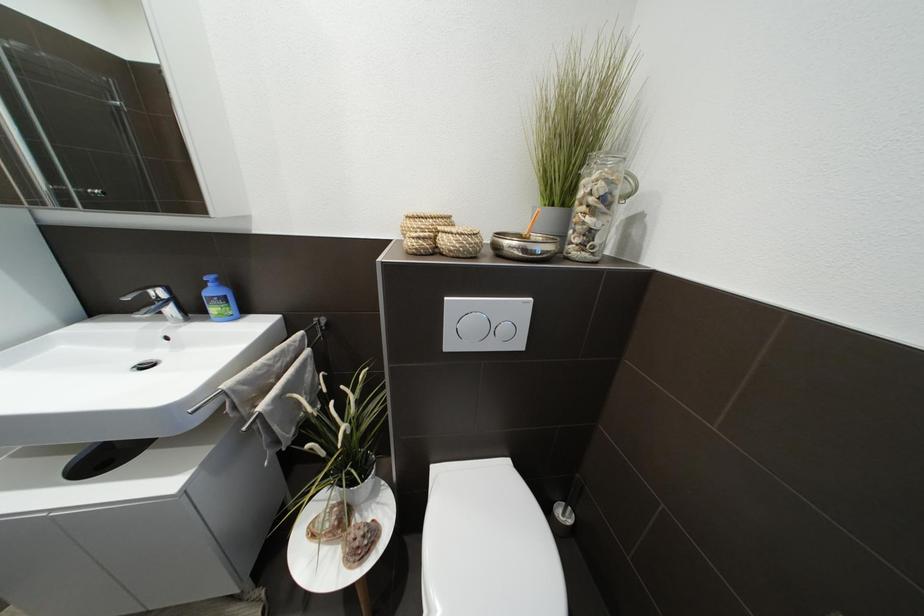
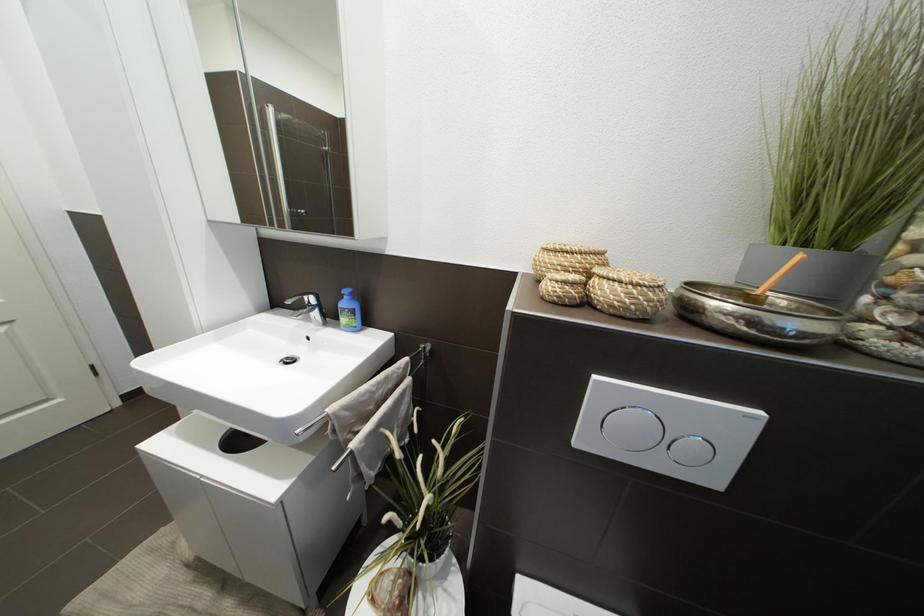
Question: The camera is either moving clockwise (left) or counter-clockwise (right) around the object. The first image is from the beginning of the video and the second image is from the end. Is the camera moving left or right when shooting the video?

Choices:
 (A) Left
 (B) Right

Answer: (B)